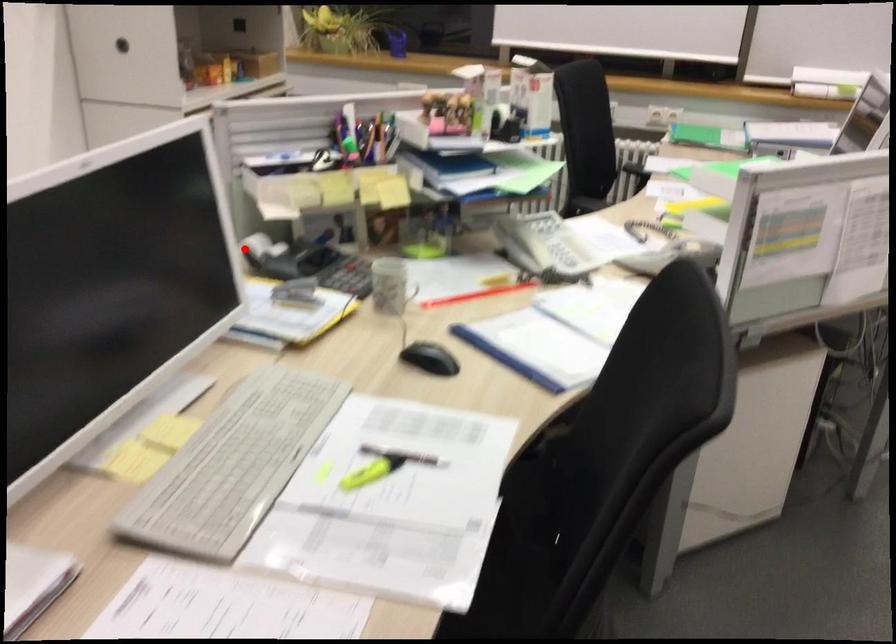
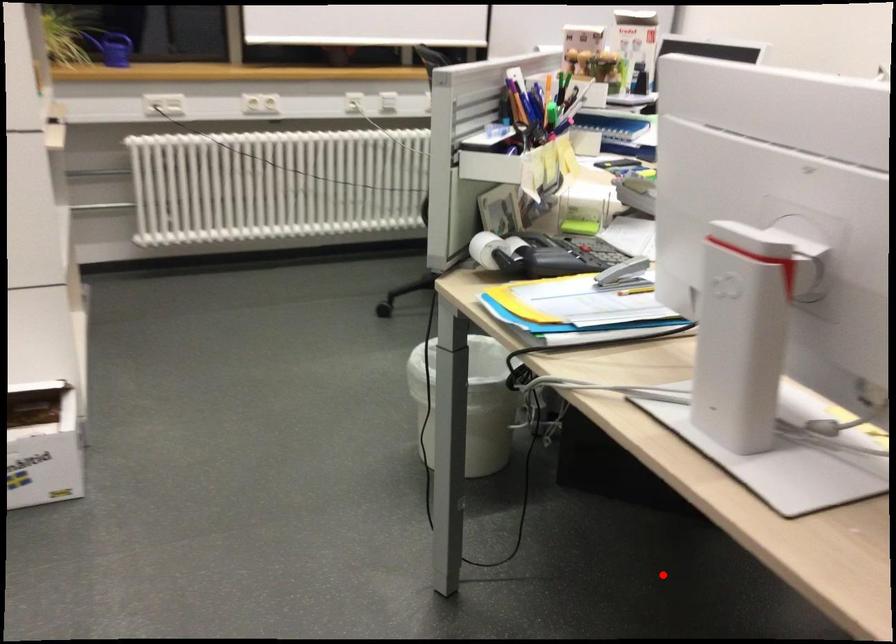
I am providing you with two images of the same scene from different viewpoints. A red point is marked on the first image and another point is marked on the second image. Does the point marked in image1 correspond to the same location as the one in image2?

No